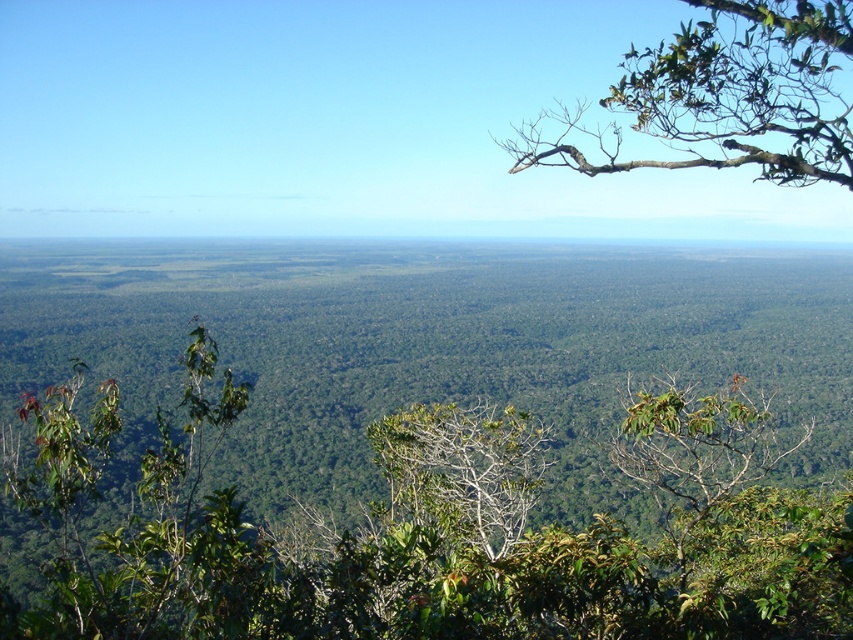
Is green leafy tree at center closer to the viewer compared to green leafy branch at upper right?

That is True.

The width and height of the screenshot is (853, 640). What do you see at coordinates (426, 531) in the screenshot?
I see `green leafy tree at center` at bounding box center [426, 531].

Does point (776, 456) come in front of point (593, 132)?

Yes.

Identify the location of green leafy tree at center. (426, 531).